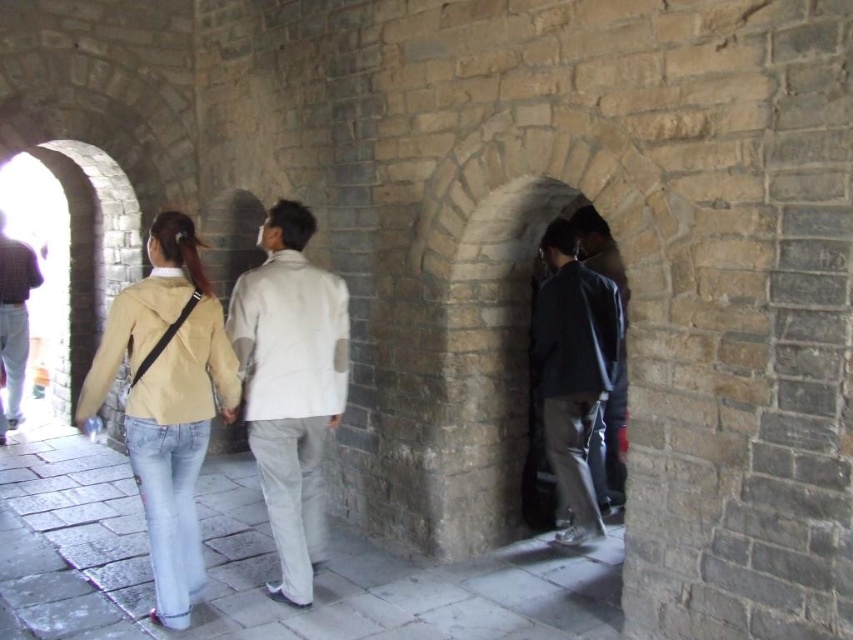
Is dark gray fabric jacket at center further to camera compared to dark brown leather jacket at left?

No, dark gray fabric jacket at center is in front of dark brown leather jacket at left.

Who is lower down, dark gray fabric jacket at center or dark brown leather jacket at left?

dark gray fabric jacket at center is lower down.

Where is `dark gray fabric jacket at center`? Image resolution: width=853 pixels, height=640 pixels. dark gray fabric jacket at center is located at coordinates (573, 369).

This screenshot has width=853, height=640. Find the location of `dark gray fabric jacket at center`. dark gray fabric jacket at center is located at coordinates (573, 369).

In the scene shown: How distant is light beige denim jacket at center from dark gray fabric jacket at center?

light beige denim jacket at center and dark gray fabric jacket at center are 6.54 feet apart from each other.

Which is above, light beige denim jacket at center or dark gray fabric jacket at center?

dark gray fabric jacket at center

Is point (155, 244) positioned in front of point (558, 432)?

Yes, point (155, 244) is in front of point (558, 432).

The image size is (853, 640). I want to click on light beige denim jacket at center, so click(167, 401).

Is white matte jacket at center to the left of dark brown leather jacket at left from the viewer's perspective?

No, white matte jacket at center is not to the left of dark brown leather jacket at left.

Is point (293, 570) positioned in front of point (9, 253)?

Yes, it is in front of point (9, 253).

Between point (292, 532) and point (3, 349), which one is positioned behind?

Positioned behind is point (3, 349).

Where is `white matte jacket at center`? This screenshot has height=640, width=853. white matte jacket at center is located at coordinates (289, 385).